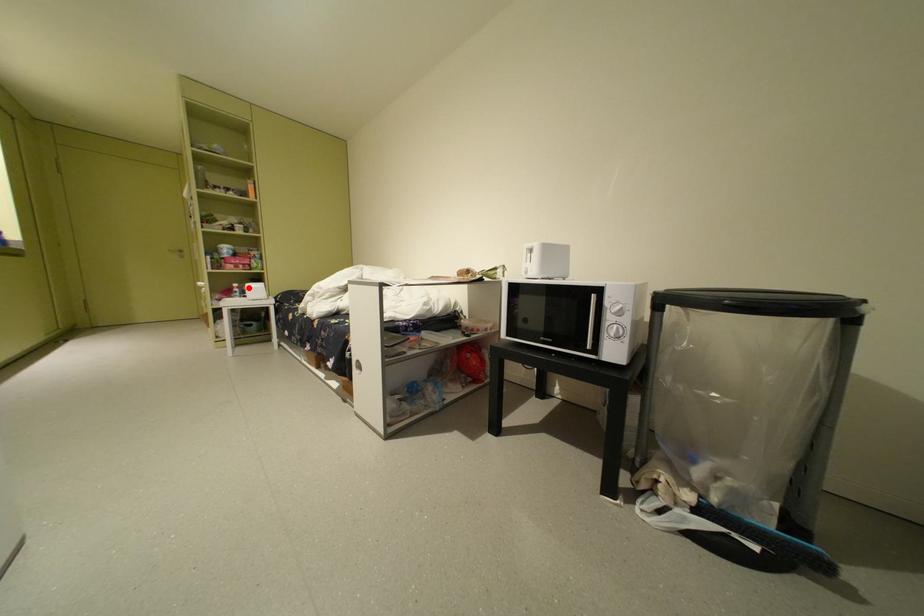
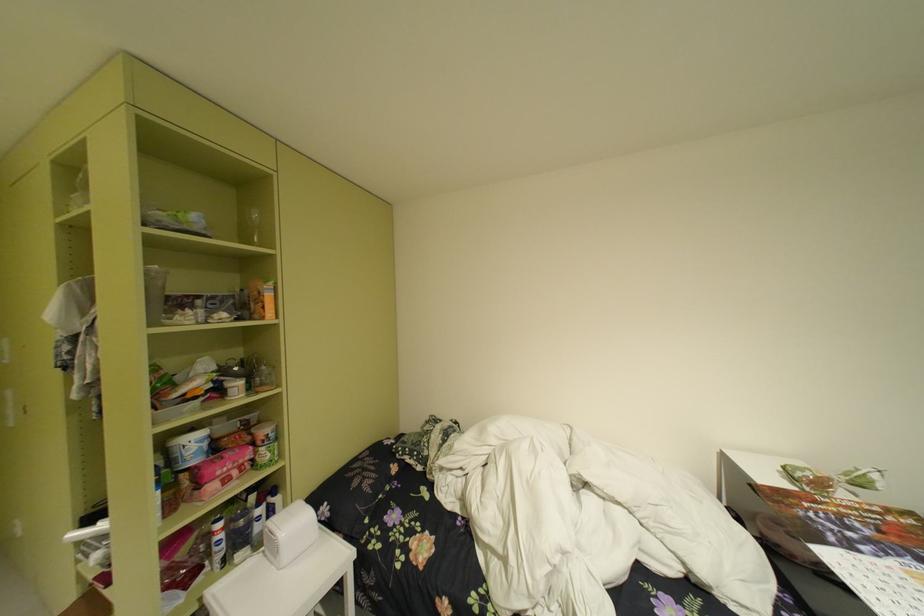
Locate, in the second image, the point that corresponds to the highlighted location in the first image.

(235, 528)